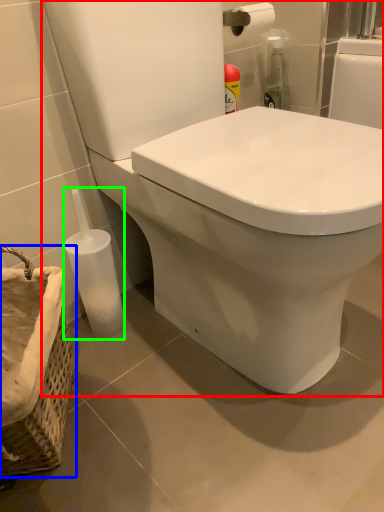
Question: Based on their relative distances, which object is nearer to toilet (highlighted by a red box)? Choose from basket container (highlighted by a blue box) and bottle (highlighted by a green box).

Choices:
 (A) basket container
 (B) bottle

Answer: (B)